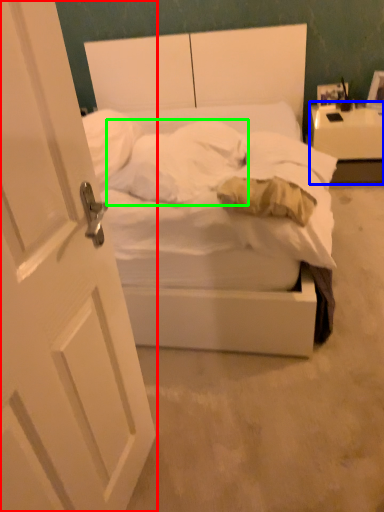
Question: Which object is the farthest from door (highlighted by a red box)? Choose among these: nightstand (highlighted by a blue box) or pillow (highlighted by a green box).

Choices:
 (A) nightstand
 (B) pillow

Answer: (A)